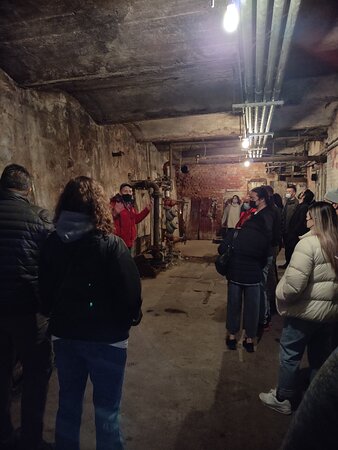
You are a GUI agent. You are given a task and a screenshot of the screen. Output one action in this format:
    pyautogui.click(x=<x>, y=<y>)
    Task: Click on the brick walls
    The image size is (338, 450).
    Given the screenshot: What is the action you would take?
    pyautogui.click(x=201, y=181), pyautogui.click(x=249, y=174), pyautogui.click(x=281, y=188), pyautogui.click(x=335, y=156), pyautogui.click(x=310, y=186)